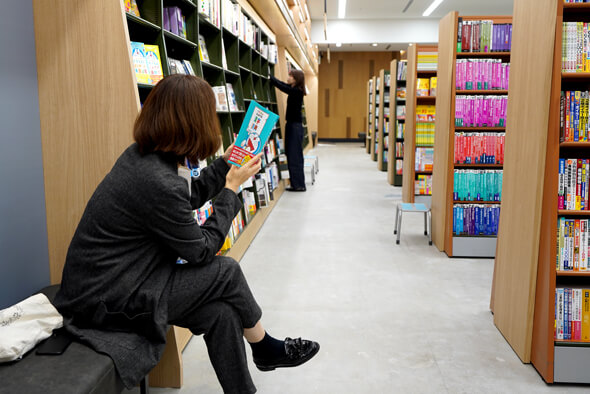
Image resolution: width=590 pixels, height=394 pixels. In order to click on blue stools in this screenshot , I will do `click(415, 211)`, `click(322, 171)`, `click(323, 158)`.